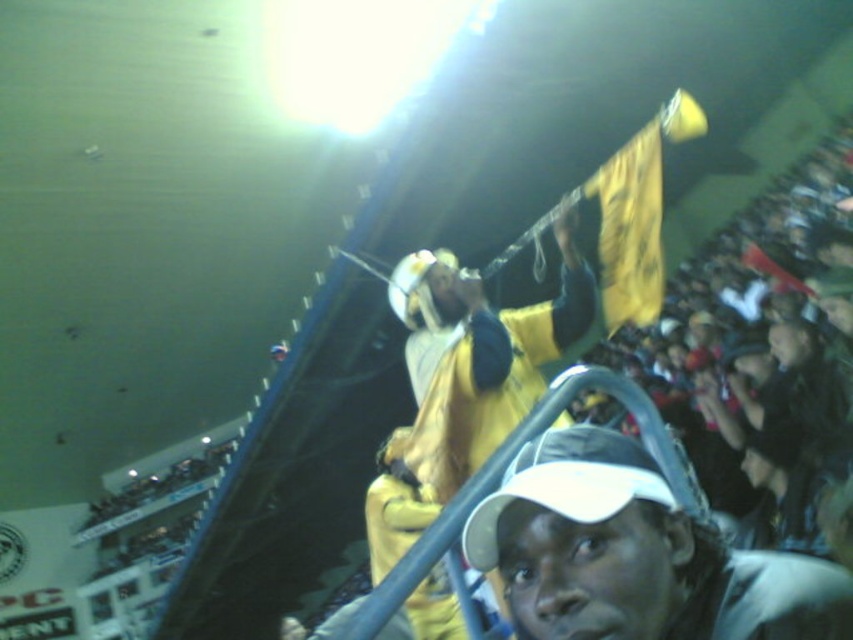
Between point (558, 557) and point (489, 422), which one is positioned in front?

Positioned in front is point (558, 557).

Is white matte cap at center smaller than yellow fabric at upper center?

Yes.

Measure the distance between white matte cap at center and camera.

The distance of white matte cap at center from camera is 1.18 meters.

This screenshot has height=640, width=853. In order to click on white matte cap at center in this screenshot , I will do `click(635, 554)`.